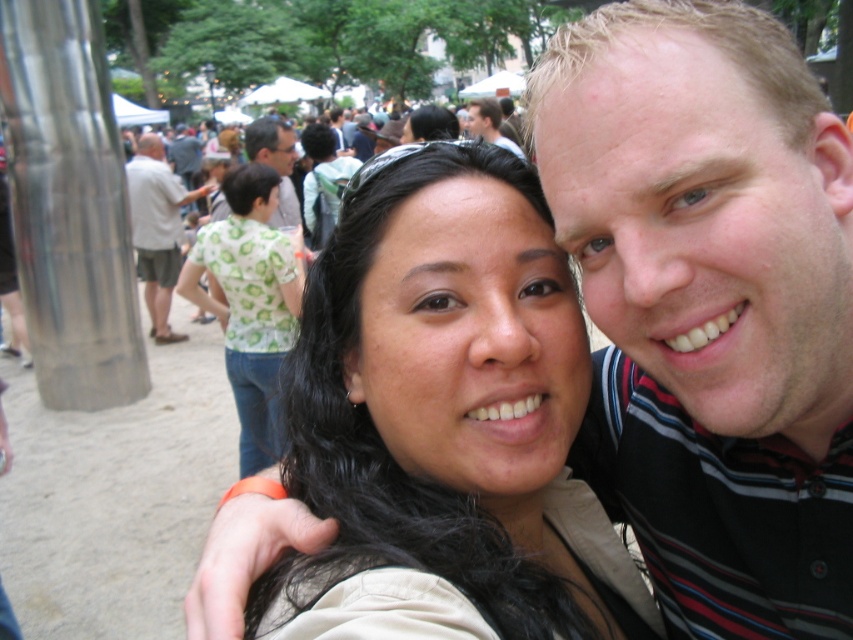
Question: Is light gray cotton shorts at left closer to the viewer compared to dark brown leather jacket at upper center?

Choices:
 (A) yes
 (B) no

Answer: (B)

Question: Can you confirm if matte khaki shirt at center is positioned to the right of dark brown leather jacket at upper center?

Choices:
 (A) no
 (B) yes

Answer: (A)

Question: Among these points, which one is nearest to the camera?

Choices:
 (A) (138, 234)
 (B) (293, 236)

Answer: (B)

Question: Does light gray cotton shorts at left have a greater width compared to dark brown leather jacket at upper center?

Choices:
 (A) no
 (B) yes

Answer: (B)

Question: Which of the following is the farthest from the observer?

Choices:
 (A) matte khaki shirt at center
 (B) green leafy shirt at center
 (C) light gray cotton shorts at left
 (D) dark brown leather jacket at upper center

Answer: (C)

Question: Which object is closer to the camera taking this photo?

Choices:
 (A) dark brown leather jacket at upper center
 (B) light gray cotton shorts at left
 (C) matte khaki shirt at center
 (D) green leafy shirt at center

Answer: (C)